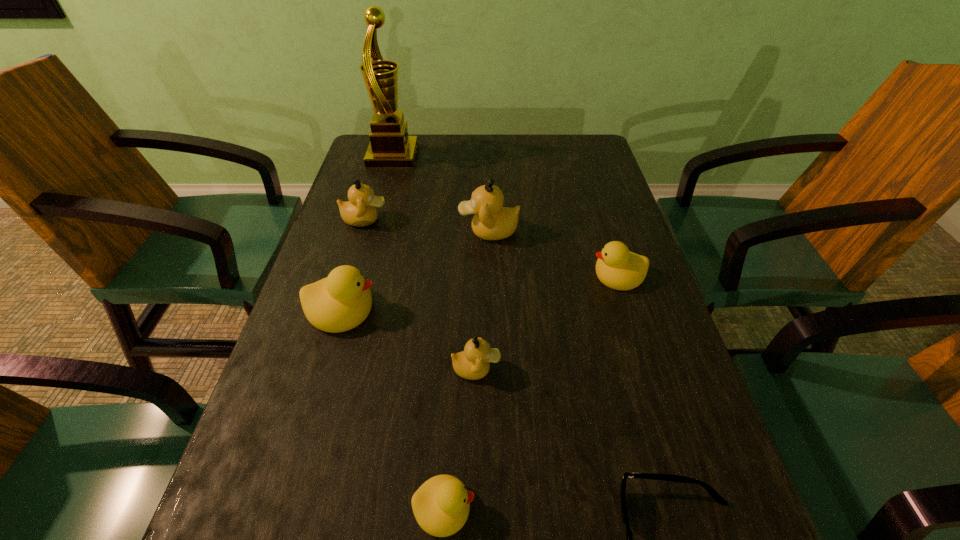
Identify the location of the nearest duckling. The height and width of the screenshot is (540, 960). (441, 505).

At what (x,y) coordinates should I click in order to perform the action: click on the shortest duckling. Please return your answer as a coordinate pair (x, y). Image resolution: width=960 pixels, height=540 pixels. Looking at the image, I should click on (441, 505).

Locate an element on the screen. vacant region located on the front-facing side of the farthest object is located at coordinates (432, 157).

At what (x,y) coordinates should I click in order to perform the action: click on vacant space located 0.230m on the face of the tallest duckling. Please return your answer as a coordinate pair (x, y). This screenshot has height=540, width=960. Looking at the image, I should click on (367, 231).

Where is `free space located 0.140m on the face of the tallest duckling`? free space located 0.140m on the face of the tallest duckling is located at coordinates (403, 231).

Where is `free spot located on the face of the tallest duckling`? The width and height of the screenshot is (960, 540). free spot located on the face of the tallest duckling is located at coordinates (347, 231).

Image resolution: width=960 pixels, height=540 pixels. What are the coordinates of `vacant space situated 0.110m on the face of the leftmost tan duckling` in the screenshot? It's located at (431, 220).

This screenshot has height=540, width=960. I want to click on vacant space located on the face of the leftmost yellow duckling, so click(x=450, y=309).

Find the location of a particular element. This screenshot has width=960, height=540. free space located 0.320m on the face of the rightmost yellow duckling is located at coordinates (448, 275).

Find the location of `blank area located on the face of the rightmost yellow duckling`. blank area located on the face of the rightmost yellow duckling is located at coordinates (475, 275).